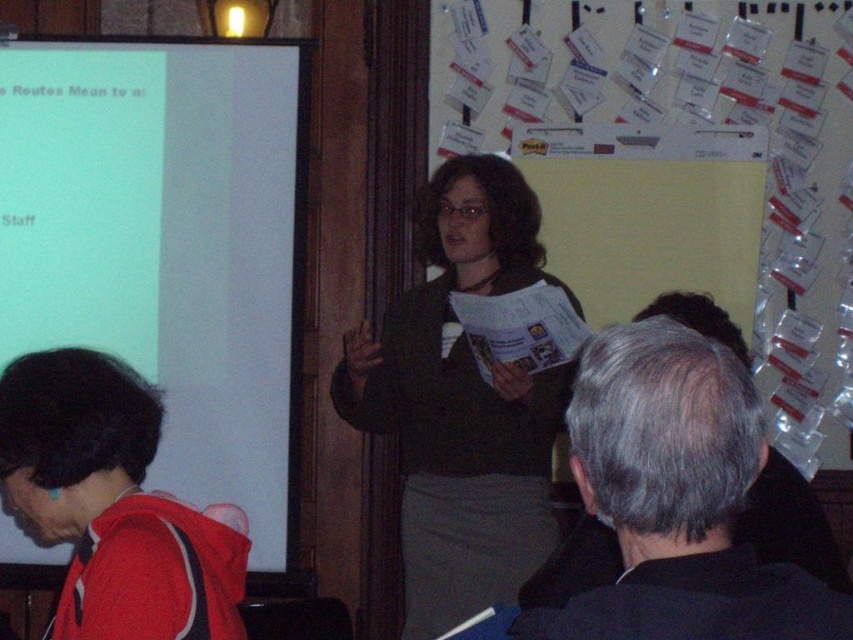
Question: Does white matte projection screen at left have a lesser width compared to red fleece jacket at lower left?

Choices:
 (A) yes
 (B) no

Answer: (B)

Question: Which point appears closest to the camera in this image?

Choices:
 (A) (204, 444)
 (B) (149, 593)
 (C) (381, 356)

Answer: (B)

Question: Which of the following is the closest to the observer?

Choices:
 (A) matte black jacket at center
 (B) white paperboard at upper center
 (C) red fleece jacket at lower left

Answer: (C)

Question: Is white paperboard at upper center to the right of gray hair at upper right from the viewer's perspective?

Choices:
 (A) yes
 (B) no

Answer: (A)

Question: Is white matte projection screen at left bigger than red fleece jacket at lower left?

Choices:
 (A) yes
 (B) no

Answer: (A)

Question: Which object is farther from the camera taking this photo?

Choices:
 (A) gray hair at upper right
 (B) white paperboard at upper center
 (C) matte black jacket at center
 (D) white matte projection screen at left

Answer: (B)